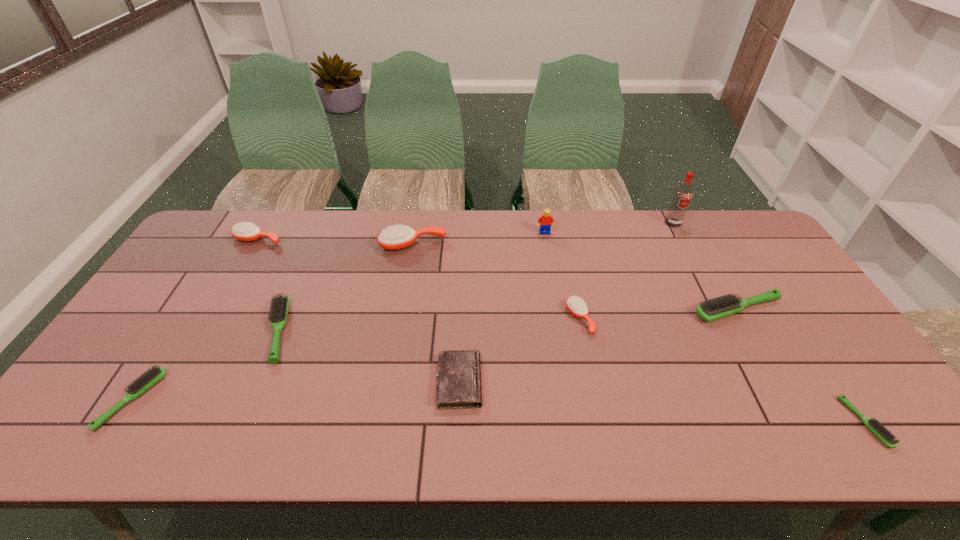
Locate an element on the screen. The height and width of the screenshot is (540, 960). object located in the near left corner section of the desktop is located at coordinates (153, 375).

Identify the location of object at the near right corner. (886, 437).

In the image, there is a desktop. What are the coordinates of `vacant region at the far edge` in the screenshot? It's located at 386,225.

The width and height of the screenshot is (960, 540). What are the coordinates of `vacant region at the near edge of the desktop` in the screenshot? It's located at (659, 421).

Identify the location of vacant area at the right edge of the desktop. The height and width of the screenshot is (540, 960). (878, 397).

You are a GUI agent. You are given a task and a screenshot of the screen. Output one action in this format:
    pyautogui.click(x=<x>, y=<y>)
    Task: Click on the vacant space at the far right corner
    This screenshot has height=540, width=960.
    Given the screenshot: What is the action you would take?
    pyautogui.click(x=750, y=250)

Locate an element on the screen. free point between the fourth object from left to right and the diary is located at coordinates (436, 313).

Locate an element on the screen. This screenshot has width=960, height=540. empty space between the biggest light hairbrush and the fourth hairbrush from right to left is located at coordinates (575, 277).

Locate an element on the screen. This screenshot has width=960, height=540. free area in between the third object from left to right and the Lego is located at coordinates coord(412,282).

You are a GUI agent. You are given a task and a screenshot of the screen. Output one action in this format:
    pyautogui.click(x=<x>, y=<y>)
    Task: Click on the free point between the rightmost orange hairbrush and the diary
    The image size is (960, 540).
    Given the screenshot: What is the action you would take?
    pyautogui.click(x=519, y=350)